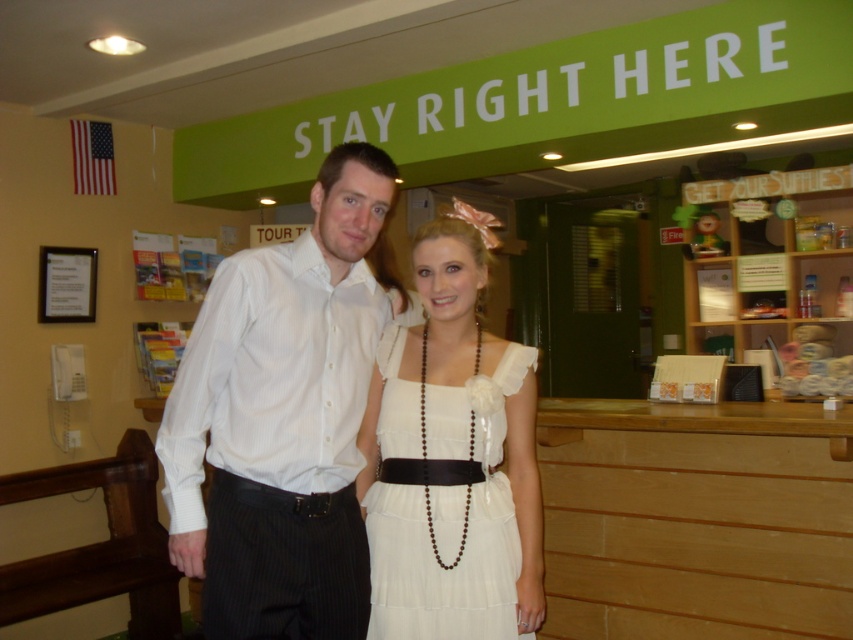
Who is shorter, wooden at right or white satin dress at center?

Standing shorter between the two is white satin dress at center.

Does wooden at right have a larger size compared to white satin dress at center?

Indeed, wooden at right has a larger size compared to white satin dress at center.

The height and width of the screenshot is (640, 853). Identify the location of wooden at right. (695, 518).

Which is above, white striped shirt at center or wooden at right?

white striped shirt at center is higher up.

Is white striped shirt at center above wooden at right?

Yes, white striped shirt at center is above wooden at right.

Identify the location of white striped shirt at center. (283, 417).

Find the location of a particular element. The height and width of the screenshot is (640, 853). white striped shirt at center is located at coordinates (283, 417).

Who is taller, white striped shirt at center or white satin dress at center?

Standing taller between the two is white striped shirt at center.

Who is more distant from viewer, (357,557) or (392,538)?

The point (357,557) is behind.

Is point (358, 413) less distant than point (386, 589)?

No, (358, 413) is further to viewer.

Where is `white striped shirt at center`? The image size is (853, 640). white striped shirt at center is located at coordinates (283, 417).